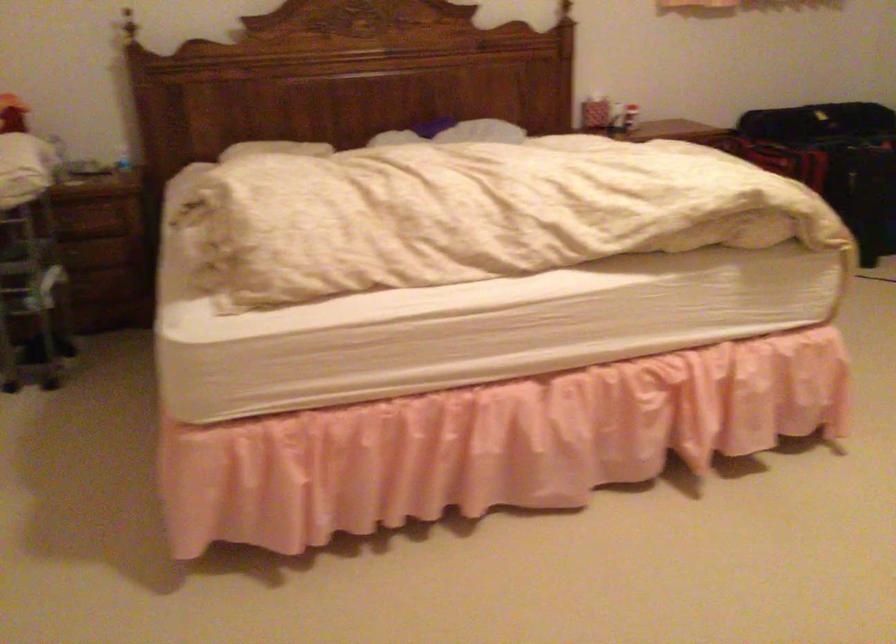
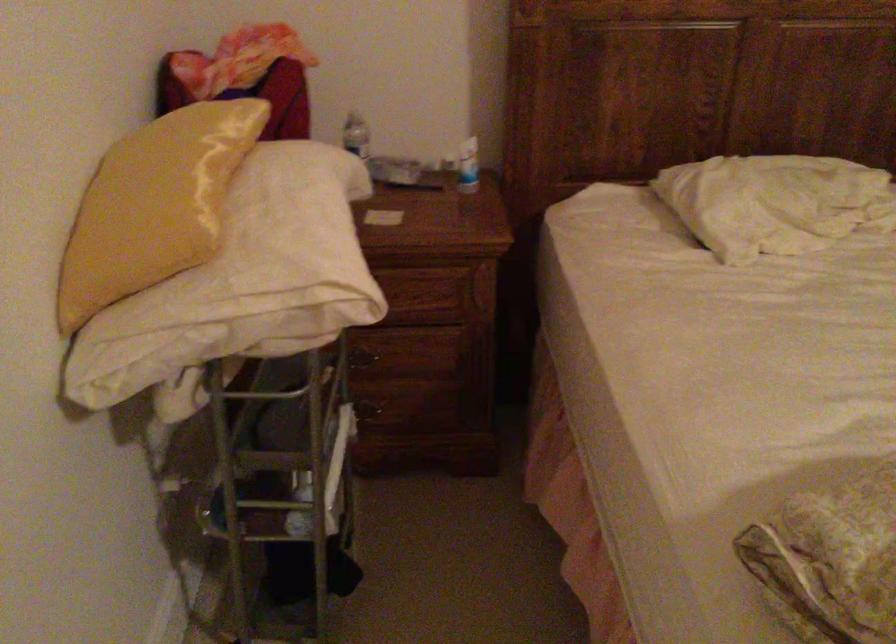
Locate, in the second image, the point that corresponds to pixel 265 144 in the first image.

(774, 202)